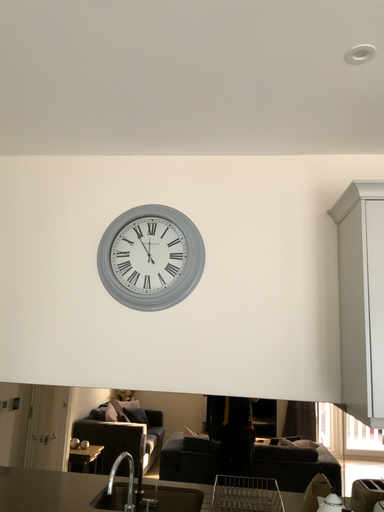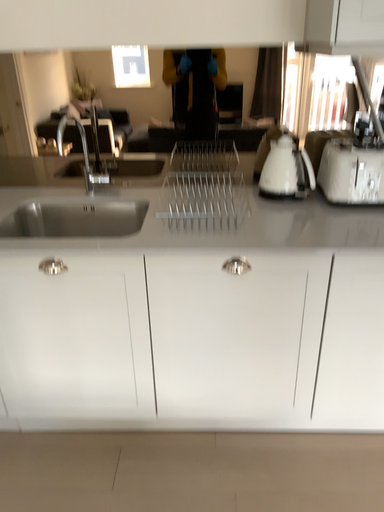
Question: Which way did the camera rotate in the video?

Choices:
 (A) rotated upward
 (B) rotated downward

Answer: (B)